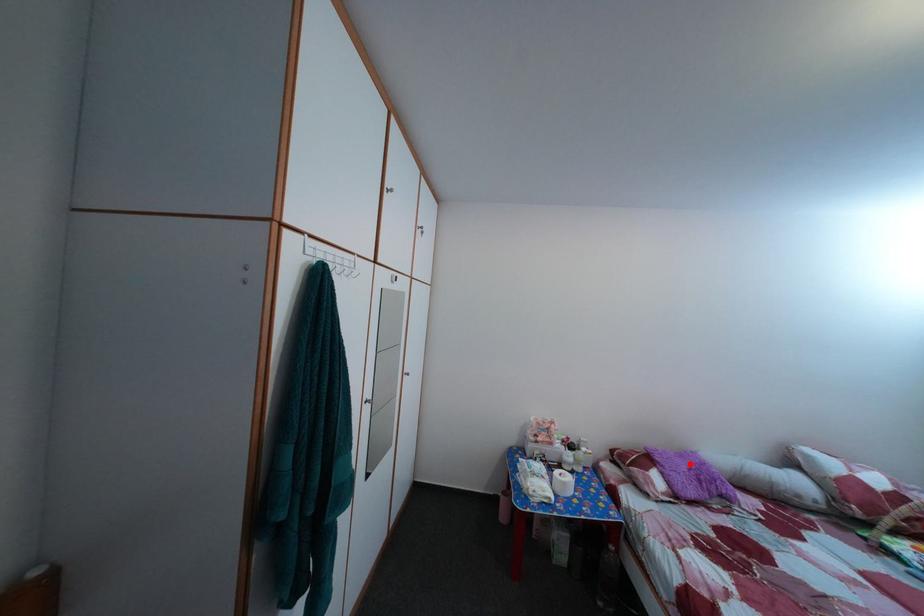
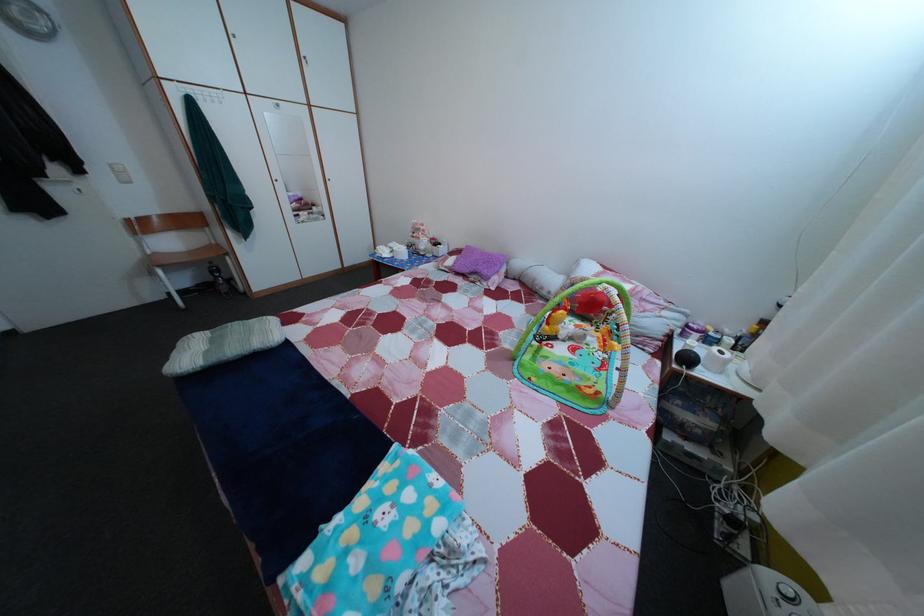
Locate, in the second image, the point that corresponds to the highlighted location in the first image.

(492, 261)